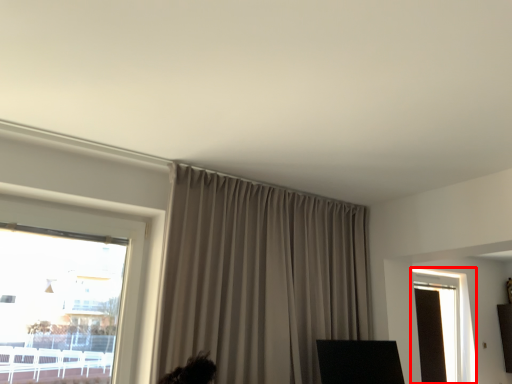
Question: Considering the relative positions of window (annotated by the red box) and curtain in the image provided, where is window (annotated by the red box) located with respect to the staircase?

Choices:
 (A) left
 (B) right

Answer: (B)